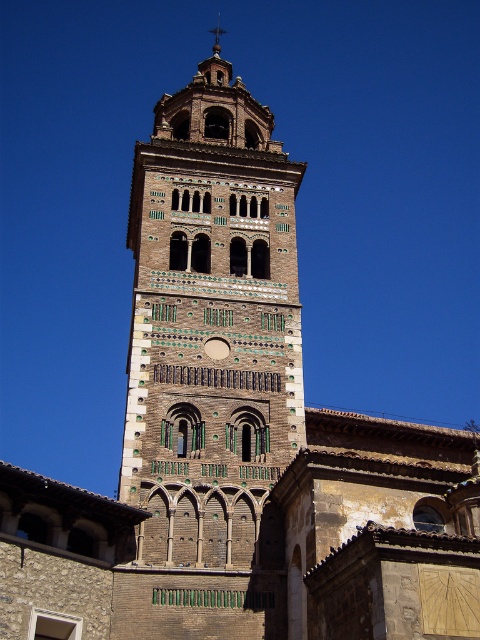
You are standing at the entrance of the church, which is located at point 0.3, 0.3. You want to walk directly towards the brown brick tower at center. In which direction should you head?

The brown brick tower at center is located at point (211, 324). Since you are at (144, 192), you should head northeast to reach it.

You are an architect examining the bell tower. You notice the brown brick tower at center and the polished copper spire at upper center. Which structure is positioned higher in the image?

The polished copper spire at upper center is positioned higher than the brown brick tower at center.

Consider the image. You are an architect visiting a historic site and notice the brown brick tower at center and the polished copper spire at upper center. Which structure has a larger overall size?

The brown brick tower at center is bigger than the polished copper spire at upper center, so the brown brick tower at center has a larger overall size.